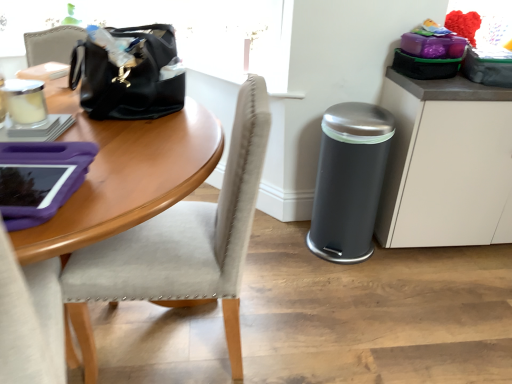
Identify the location of free region under light gray fabric chair at left (from a real-world perspective). The height and width of the screenshot is (384, 512). (176, 335).